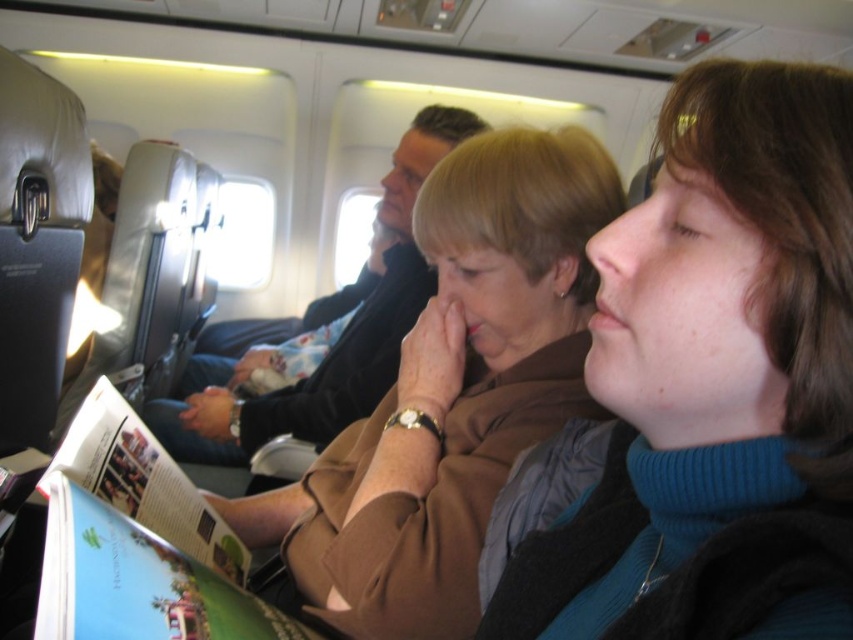
You are a flight attendant checking the overhead compartments. You see the blue fleece at center and the matte paper magazine at center. Which object is positioned to the right when viewed from the front?

The blue fleece at center is to the right of the matte paper magazine at center.

In the scene shown: You are seated in an airplane cabin and notice two items in front of you. The blue fleece at center and the brown fabric jacket at center. Which item is located to the right when viewed from your perspective?

The blue fleece at center is positioned on the right side of brown fabric jacket at center, so when viewed from your perspective, the blue fleece at center is to the right of the brown fabric jacket at center.

Consider the image. You are a flight attendant checking the seating arrangement. The brown fabric jacket at center is located at coordinates point 0.613, 0.531. Is this jacket closer to the front or the back of the airplane cabin?

The brown fabric jacket at center is located at point (451, 392). Since the coordinate system typically starts at the front of the cabin as 0.0, the higher the first number, the closer to the back. Therefore, 0.613 indicates it is closer to the back of the airplane cabin.